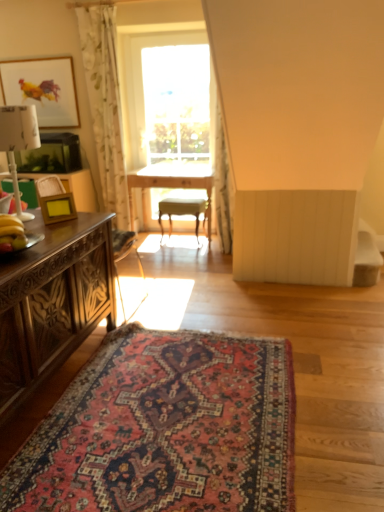
You are a GUI agent. You are given a task and a screenshot of the screen. Output one action in this format:
    pyautogui.click(x=<x>, y=<y>)
    Task: Click on the vacant space situated above clear glass window at center (from a real-world perspective)
    
    Given the screenshot: What is the action you would take?
    pyautogui.click(x=173, y=31)